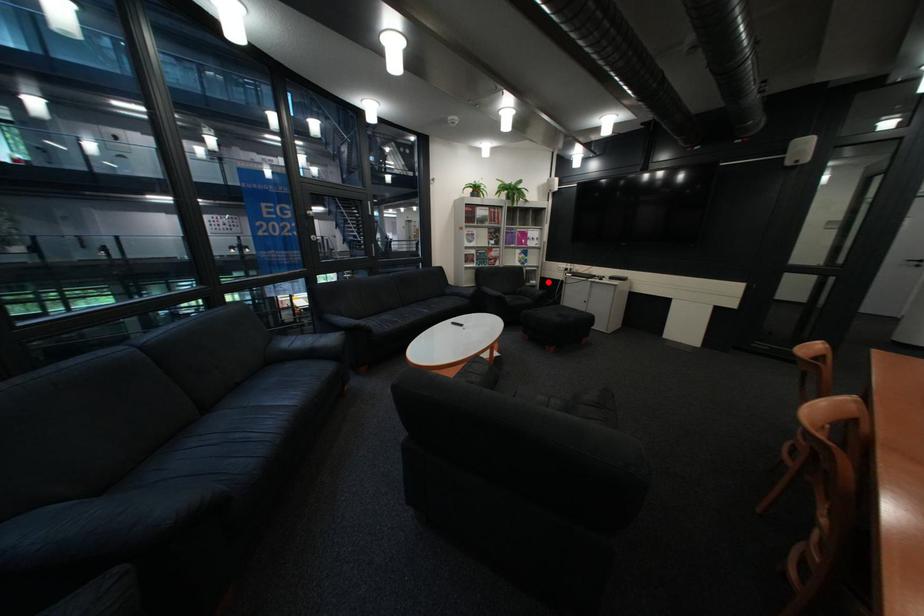
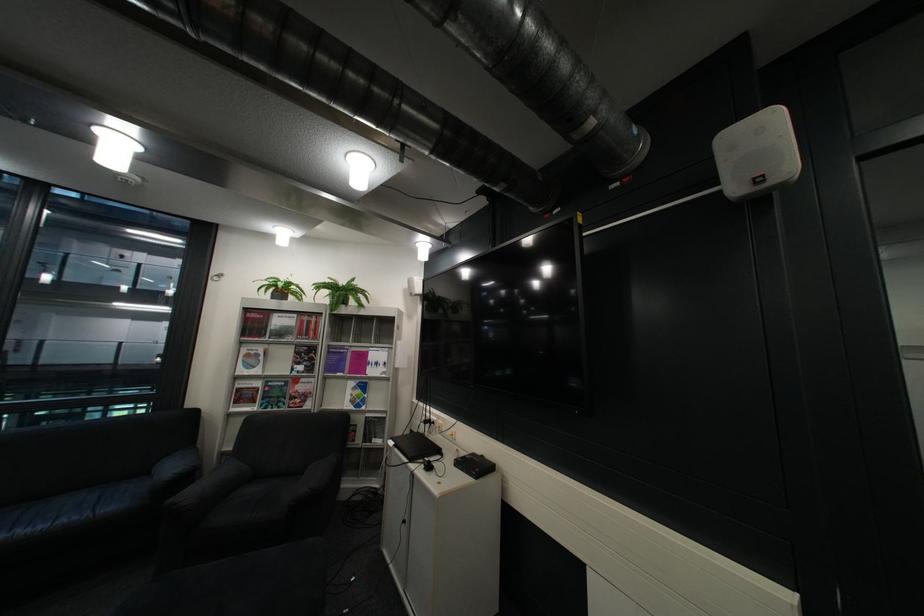
Locate, in the second image, the point that corresponds to the highlighted location in the first image.

(393, 442)